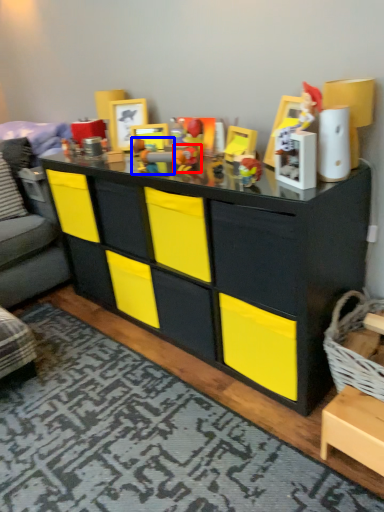
Question: Which object appears closest to the camera in this image, toy (highlighted by a red box) or toy (highlighted by a blue box)?

Choices:
 (A) toy
 (B) toy

Answer: (B)